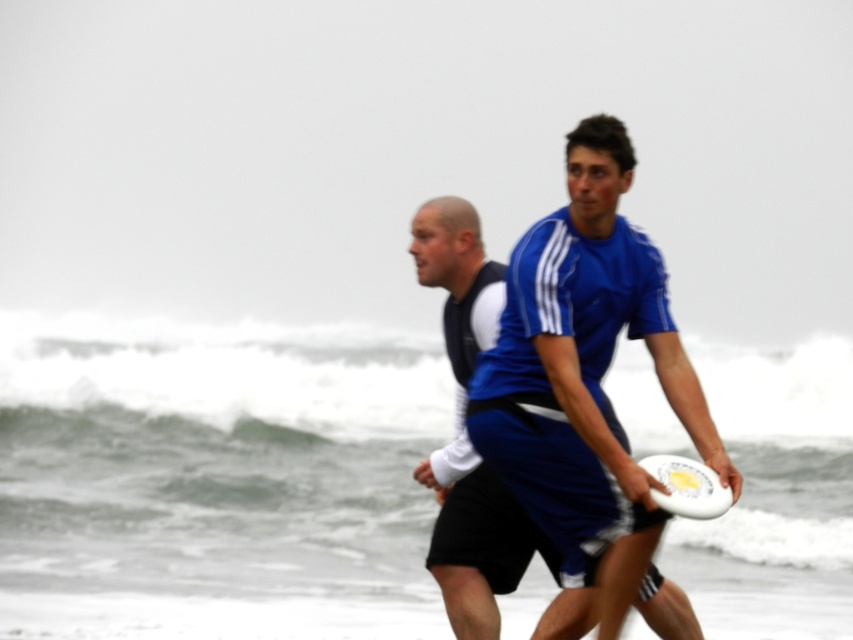
You are a sports equipment inspector checking the dimensions of the blue fabric shirt at center and the white plastic frisbee at center. Which object has a greater width?

The blue fabric shirt at center has a greater width than the white plastic frisbee at center according to the description.

You are a photographer trying to capture the white plastic frisbee at center in a photo. The white foamy wave at center is also in the frame. Which object will appear wider in the photo?

The white foamy wave at center will appear wider in the photo since its width is larger than the white plastic frisbee at center.

You are a photographer at the beach and want to take a photo of the blue fabric shirt at center and the white plastic frisbee at center. Which object should you focus on first if you want to capture both clearly in your shot?

The blue fabric shirt at center is larger in size than the white plastic frisbee at center, so you should focus on the blue fabric shirt at center first to ensure it is in clear focus before adjusting for the smaller frisbee.